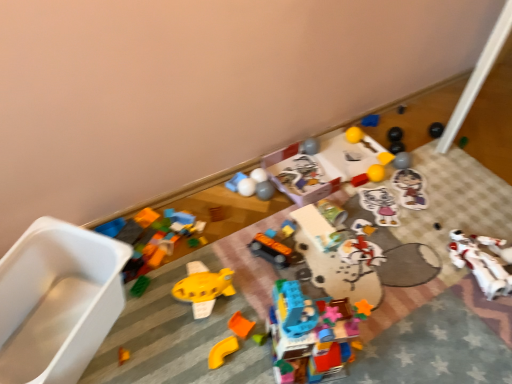
Locate an element on the screen. free space to the left of matte white plush cat at center, the thirteenth toy viewed from the left is located at coordinates (343, 205).